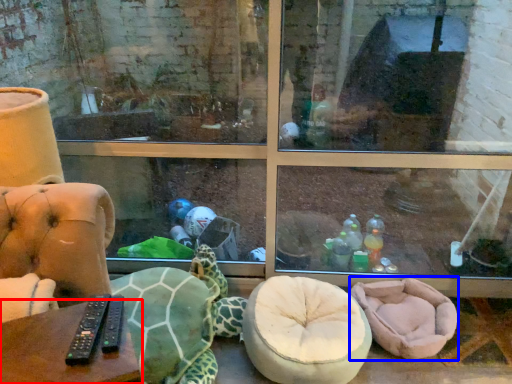
Question: Among these objects, which one is farthest to the camera, table (highlighted by a red box) or bean bag chair (highlighted by a blue box)?

Choices:
 (A) table
 (B) bean bag chair

Answer: (B)